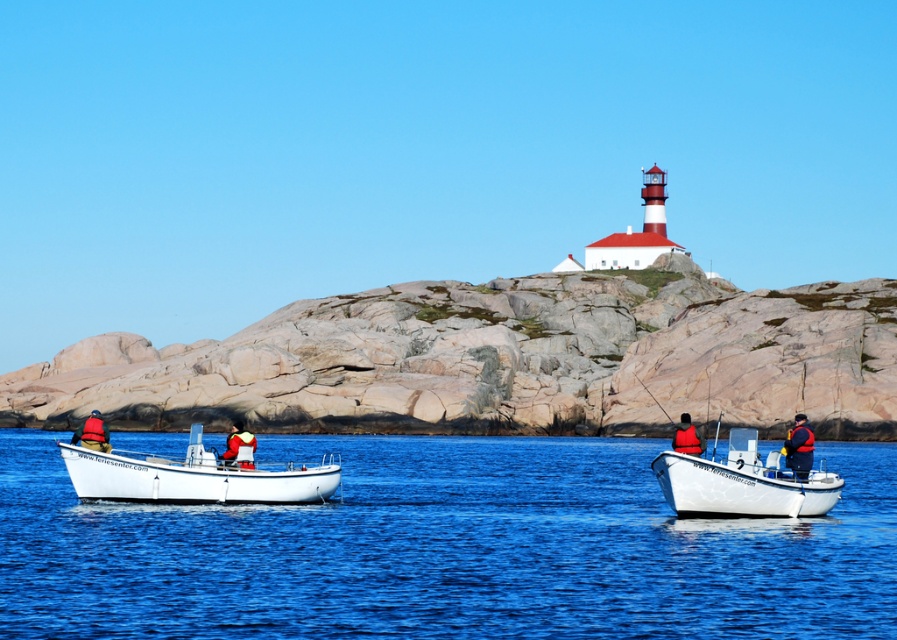
Question: Which object is closer to the camera taking this photo?

Choices:
 (A) red life vest at center
 (B) white matte boat at center
 (C) red life vest at left

Answer: (B)

Question: Does blue water at center have a smaller size compared to red life jacket at center?

Choices:
 (A) yes
 (B) no

Answer: (B)

Question: Which point is farther to the camera?

Choices:
 (A) red life vest at center
 (B) white matte boat at center

Answer: (A)

Question: Does blue water at center appear on the left side of red life vest at left?

Choices:
 (A) yes
 (B) no

Answer: (B)

Question: Estimate the real-world distances between objects in this image. Which object is farther from the white matte boat at left?

Choices:
 (A) blue water at center
 (B) red life jacket at center
 (C) white matte boat at center

Answer: (C)

Question: Can you confirm if blue water at center is smaller than white matte boat at center?

Choices:
 (A) yes
 (B) no

Answer: (B)